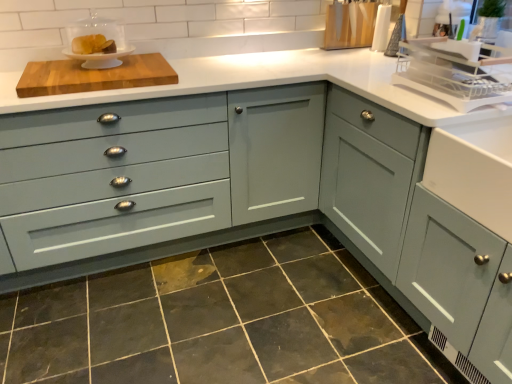
Question: Should I look upward or downward to see white glossy cake stand at upper left, positioned as the third appliance in right-to-left order?

Choices:
 (A) up
 (B) down

Answer: (A)

Question: Does white glossy cake stand at upper left, positioned as the third appliance in right-to-left order, contain dark gray granite at lower center?

Choices:
 (A) no
 (B) yes

Answer: (A)

Question: Is white glossy cake stand at upper left, which appears as the 1th appliance when viewed from the left, smaller than dark gray granite at lower center?

Choices:
 (A) yes
 (B) no

Answer: (A)

Question: From the image's perspective, does white glossy cake stand at upper left, arranged as the second appliance when viewed from the front, appear lower than dark gray granite at lower center?

Choices:
 (A) no
 (B) yes

Answer: (A)

Question: Is white glossy cake stand at upper left, positioned as the third appliance in right-to-left order, at the right side of dark gray granite at lower center?

Choices:
 (A) no
 (B) yes

Answer: (A)

Question: Considering the relative positions of white glossy cake stand at upper left, the 2th appliance when ordered from back to front, and dark gray granite at lower center in the image provided, is white glossy cake stand at upper left, the 2th appliance when ordered from back to front, in front of dark gray granite at lower center?

Choices:
 (A) yes
 (B) no

Answer: (B)

Question: Does white glossy cake stand at upper left, arranged as the second appliance when viewed from the front, lie behind dark gray granite at lower center?

Choices:
 (A) no
 (B) yes

Answer: (B)

Question: Is wooden knife block at upper right, which ranks as the first appliance in back-to-front order, to the left of dark gray granite at lower center from the viewer's perspective?

Choices:
 (A) no
 (B) yes

Answer: (A)

Question: Is dark gray granite at lower center surrounded by wooden knife block at upper right, the second appliance from the left?

Choices:
 (A) yes
 (B) no

Answer: (B)

Question: From the image's perspective, does wooden knife block at upper right, which ranks as the first appliance in back-to-front order, appear higher than dark gray granite at lower center?

Choices:
 (A) yes
 (B) no

Answer: (A)

Question: Is wooden knife block at upper right, which is the third appliance in front-to-back order, wider than dark gray granite at lower center?

Choices:
 (A) no
 (B) yes

Answer: (A)

Question: Does wooden knife block at upper right, which is the third appliance in front-to-back order, lie behind dark gray granite at lower center?

Choices:
 (A) no
 (B) yes

Answer: (B)

Question: Can you confirm if wooden knife block at upper right, acting as the second appliance starting from the right, is positioned to the right of dark gray granite at lower center?

Choices:
 (A) yes
 (B) no

Answer: (A)

Question: Is matte gray cabinet at right, which is the 2th cabinetry in left-to-right order, turned away from matte gray cabinet at center, which is the second cabinetry from right to left?

Choices:
 (A) yes
 (B) no

Answer: (B)